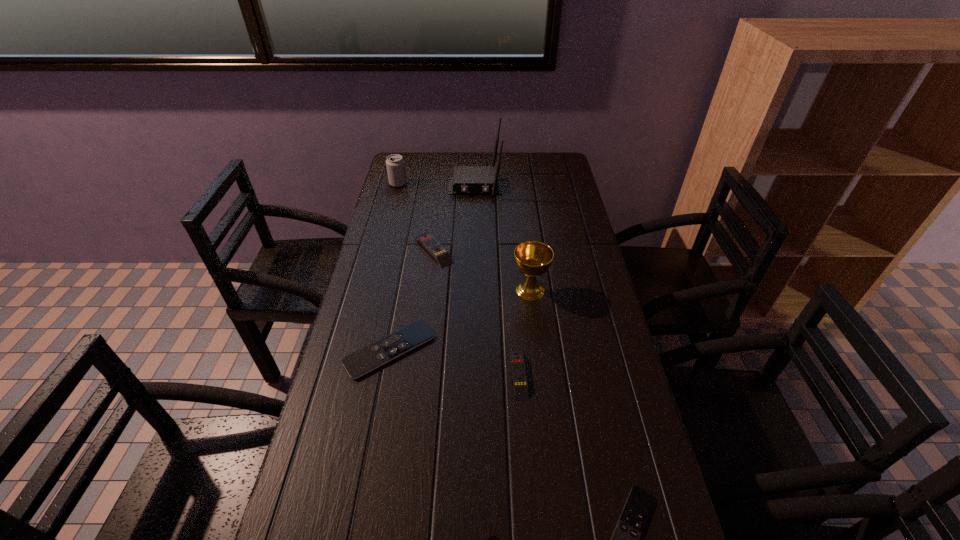
This screenshot has height=540, width=960. I want to click on the tallest object, so click(x=466, y=180).

The height and width of the screenshot is (540, 960). In order to click on the fourth farthest object in this screenshot , I will do `click(533, 258)`.

Find the location of a particular element. the seventh shortest object is located at coordinates (533, 258).

Locate an element on the screen. Image resolution: width=960 pixels, height=540 pixels. the third tallest object is located at coordinates (395, 164).

This screenshot has width=960, height=540. Identify the location of the farthest remote control. (441, 255).

This screenshot has width=960, height=540. I want to click on the fourth tallest object, so click(x=441, y=255).

Locate an element on the screen. The height and width of the screenshot is (540, 960). the fifth tallest object is located at coordinates (519, 375).

Find the location of `the nearer yellow remote control`. the nearer yellow remote control is located at coordinates (519, 375).

The image size is (960, 540). Identify the location of the third tallest remote control. (376, 354).

Where is `the leftmost black remote control`? This screenshot has width=960, height=540. the leftmost black remote control is located at coordinates (376, 354).